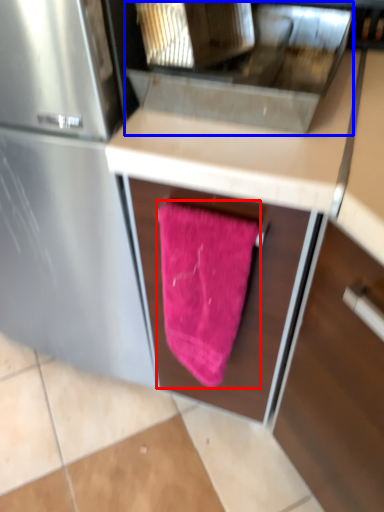
Question: Which point is closer to the camera, beach towel (highlighted by a red box) or sink (highlighted by a blue box)?

Choices:
 (A) beach towel
 (B) sink

Answer: (B)